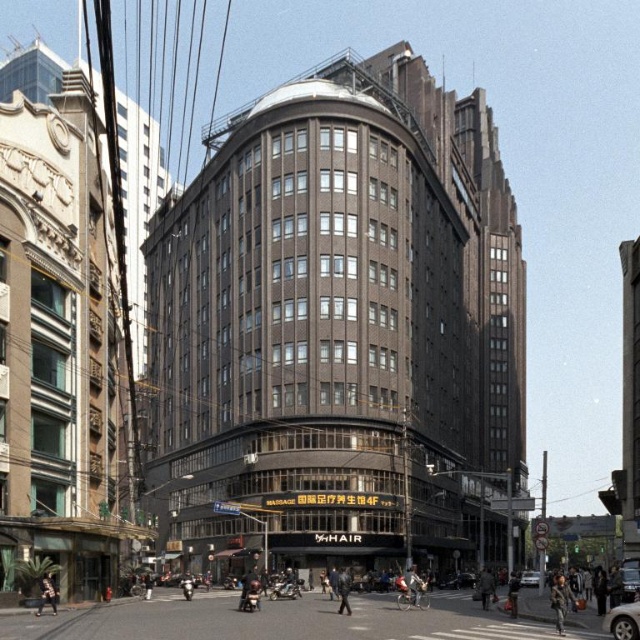
Does silver metallic car at lower right have a larger size compared to denim jacket at lower center?

Indeed, silver metallic car at lower right has a larger size compared to denim jacket at lower center.

Who is more distant from viewer, (625, 609) or (342, 579)?

The point (342, 579) is more distant.

Identify the location of silver metallic car at lower right. The width and height of the screenshot is (640, 640). (624, 620).

Is khaki fabric jacket at lower right wider than silver metallic car at center?

Indeed, khaki fabric jacket at lower right has a greater width compared to silver metallic car at center.

Measure the distance between khaki fabric jacket at lower right and camera.

khaki fabric jacket at lower right and camera are 65.42 meters apart.

Between point (563, 579) and point (532, 579), which one is positioned in front?

Point (563, 579) is in front.

I want to click on khaki fabric jacket at lower right, so click(561, 600).

Does point (557, 627) come closer to viewer compared to point (515, 570)?

Yes.

Does point (564, 589) come in front of point (508, 609)?

Yes, point (564, 589) is closer to viewer.

This screenshot has height=640, width=640. In order to click on khaki fabric jacket at lower right in this screenshot , I will do click(x=561, y=600).